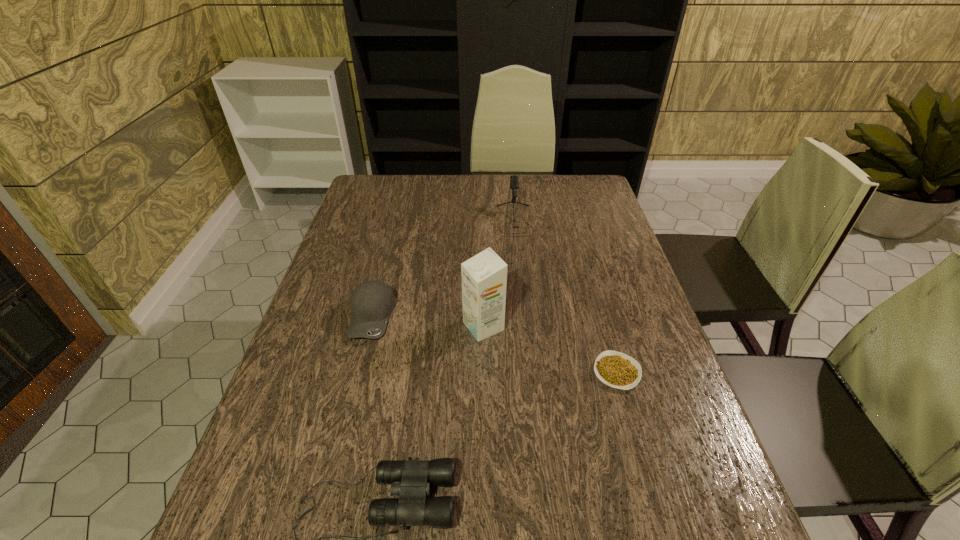
Find the location of a particular element. This screenshot has width=960, height=540. object at the far edge is located at coordinates (514, 182).

Identify the location of object that is at the left edge. The width and height of the screenshot is (960, 540). (372, 302).

This screenshot has height=540, width=960. I want to click on object that is at the right edge, so click(618, 370).

This screenshot has width=960, height=540. In order to click on vacant space at the far edge of the desktop in this screenshot , I will do `click(531, 180)`.

At what (x,y) coordinates should I click in order to perform the action: click on vacant area at the left edge. Please return your answer as a coordinate pair (x, y). The image size is (960, 540). Looking at the image, I should click on (308, 500).

Image resolution: width=960 pixels, height=540 pixels. I want to click on vacant space at the right edge, so click(x=616, y=229).

The width and height of the screenshot is (960, 540). I want to click on free space at the far right corner of the desktop, so click(579, 202).

In order to click on vacant area that lies between the second nearest object and the third tallest object in this screenshot , I will do `click(494, 345)`.

You are a GUI agent. You are given a task and a screenshot of the screen. Output one action in this format:
    pyautogui.click(x=<x>, y=<y>)
    Task: Click on the free space between the rightmost object and the tallest object
    This screenshot has height=540, width=960.
    Given the screenshot: What is the action you would take?
    [550, 349]

This screenshot has height=540, width=960. Find the location of `free point between the shortest object and the second tallest object`. free point between the shortest object and the second tallest object is located at coordinates (564, 296).